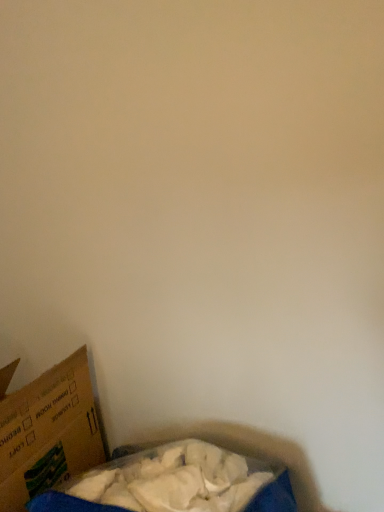
The width and height of the screenshot is (384, 512). Describe the element at coordinates (48, 432) in the screenshot. I see `cardboard box at lower left` at that location.

What are the coordinates of `cardboard box at lower left` in the screenshot? It's located at (48, 432).

The image size is (384, 512). I want to click on cardboard box at lower left, so click(48, 432).